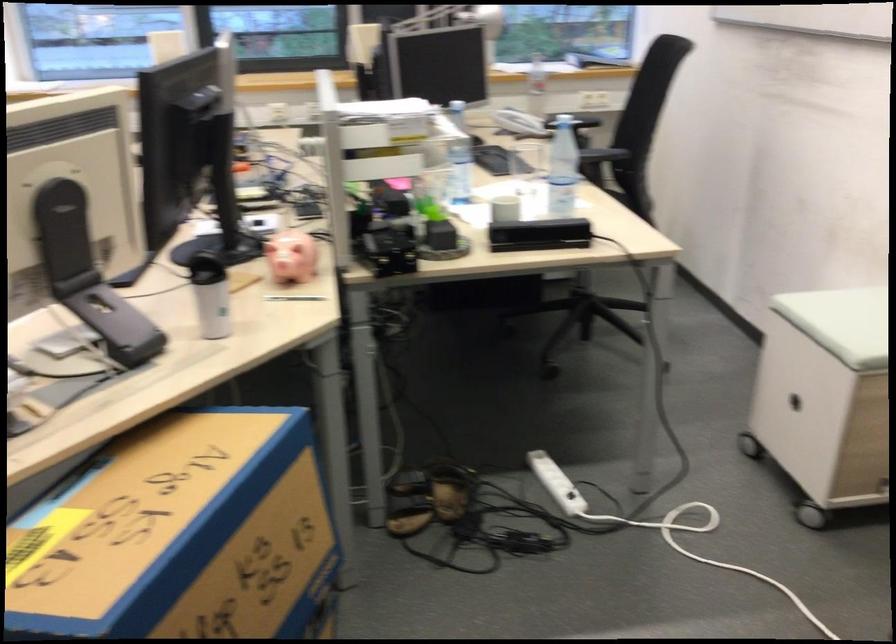
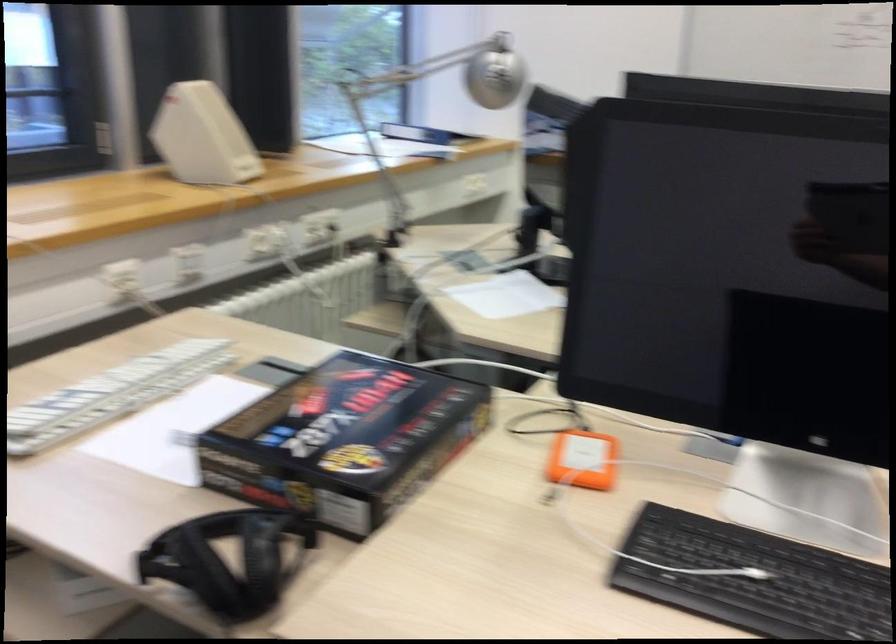
Find the pixel in the second image that matches (x=234, y=167) in the first image.

(582, 460)